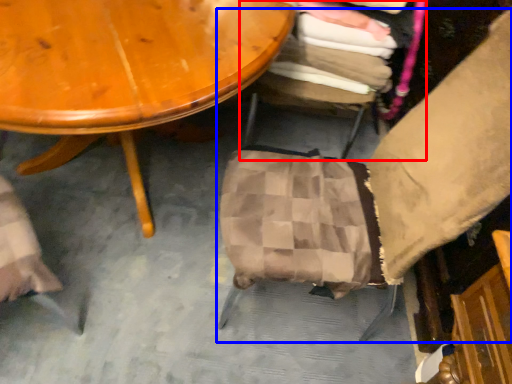
Question: Which point is further to the camera, chair (highlighted by a red box) or chair (highlighted by a blue box)?

Choices:
 (A) chair
 (B) chair

Answer: (A)